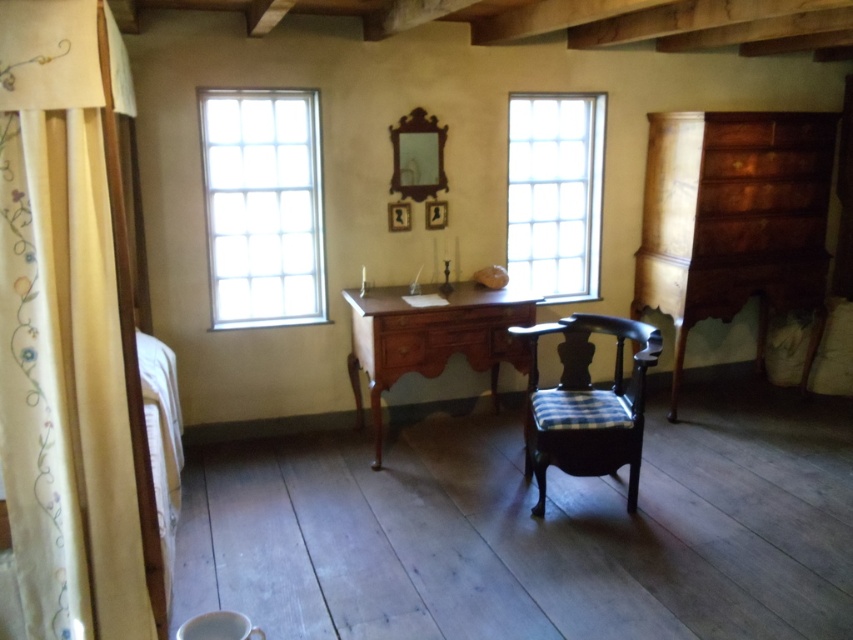
Question: Considering the relative positions of embroidered cotton curtain at left and shiny brown wood dresser at right in the image provided, where is embroidered cotton curtain at left located with respect to shiny brown wood dresser at right?

Choices:
 (A) right
 (B) left

Answer: (B)

Question: Where is clear glass window at upper right located in relation to wooden desk at center in the image?

Choices:
 (A) right
 (B) left

Answer: (A)

Question: Among these objects, which one is farthest from the camera?

Choices:
 (A) clear glass window at upper left
 (B) wooden desk at center
 (C) embroidered cotton curtain at left
 (D) shiny brown wood dresser at right

Answer: (D)

Question: Among these points, which one is farthest from the camera?

Choices:
 (A) (532, 273)
 (B) (624, 429)
 (C) (387, 364)
 (D) (222, 252)

Answer: (A)

Question: Is embroidered cotton curtain at left positioned before dark wood chair with blue plaid cushion at center?

Choices:
 (A) no
 (B) yes

Answer: (B)

Question: Which of the following is the farthest from the observer?

Choices:
 (A) clear glass window at upper left
 (B) wooden desk at center
 (C) clear glass window at upper right
 (D) shiny brown wood dresser at right

Answer: (C)